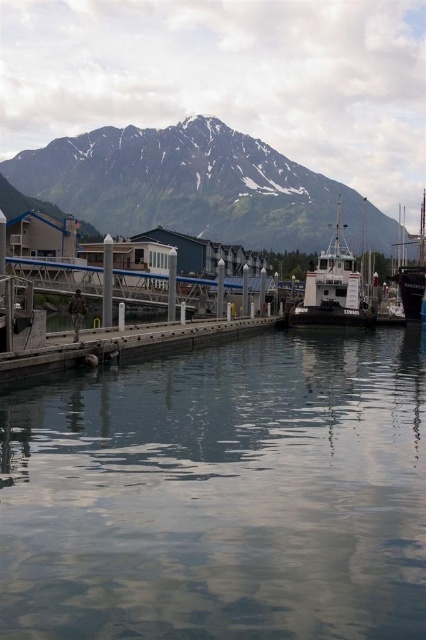
Question: Which object is positioned closest to the shiny black sailboat at right?

Choices:
 (A) clear water at center
 (B) snowy granite mountain at upper center

Answer: (A)

Question: Which object appears farthest from the camera in this image?

Choices:
 (A) clear water at center
 (B) shiny black sailboat at right

Answer: (B)

Question: Can you confirm if snowy granite mountain at upper center is positioned above white matte boat at center?

Choices:
 (A) yes
 (B) no

Answer: (A)

Question: Observing the image, what is the correct spatial positioning of clear water at center in reference to snowy granite mountain at upper center?

Choices:
 (A) right
 (B) left

Answer: (A)

Question: Estimate the real-world distances between objects in this image. Which object is closer to the clear water at center?

Choices:
 (A) white matte boat at center
 (B) shiny black sailboat at right
 (C) snowy granite mountain at upper center

Answer: (A)

Question: Is white matte boat at center behind shiny black sailboat at right?

Choices:
 (A) no
 (B) yes

Answer: (A)